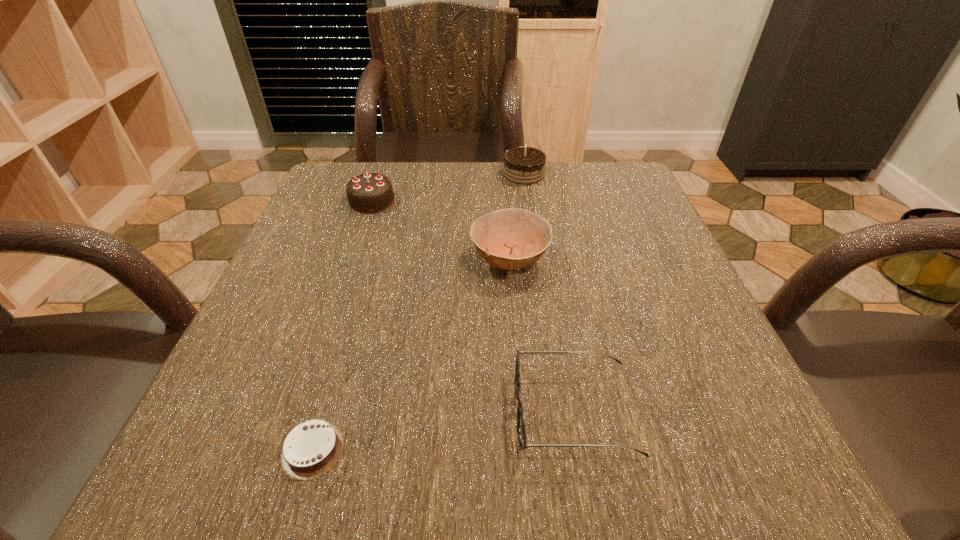
Find the location of a particular element. The image size is (960, 540). free spot that satisfies the following two spatial constraints: 1. on the back side of the fourth nearest object; 2. on the left side of the rightmost chocolate cake is located at coordinates (381, 174).

This screenshot has width=960, height=540. In order to click on free spot that satisfies the following two spatial constraints: 1. on the front side of the nearest chocolate cake; 2. on the left side of the second farthest object in this screenshot , I will do `click(288, 449)`.